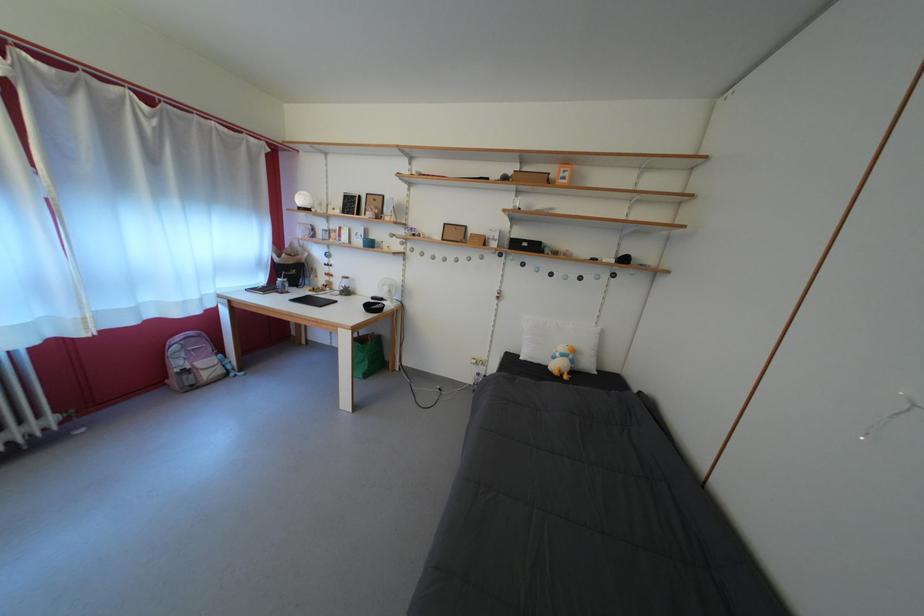
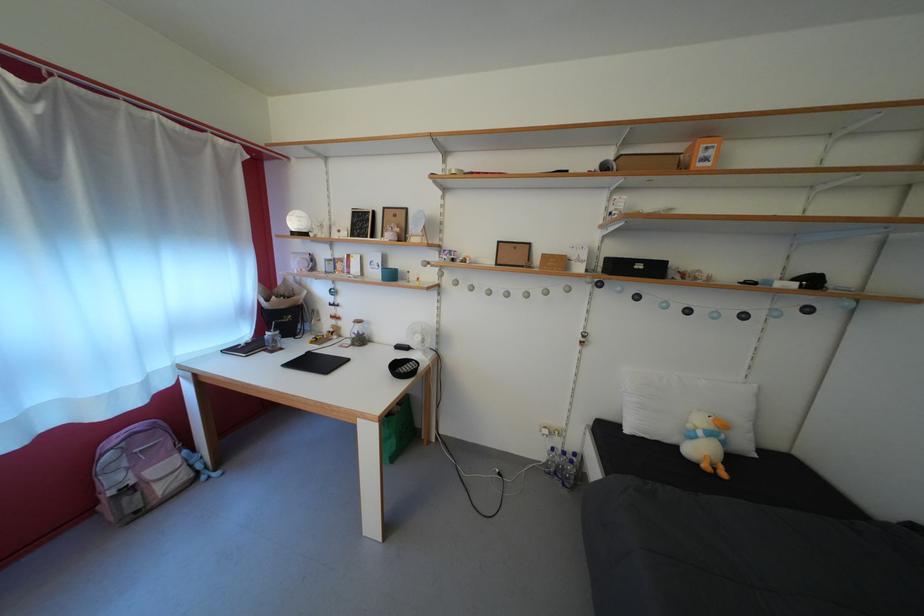
In the scene shown: Which direction would the cameraman need to move to produce the second image?

The cameraman walked toward left, forward.